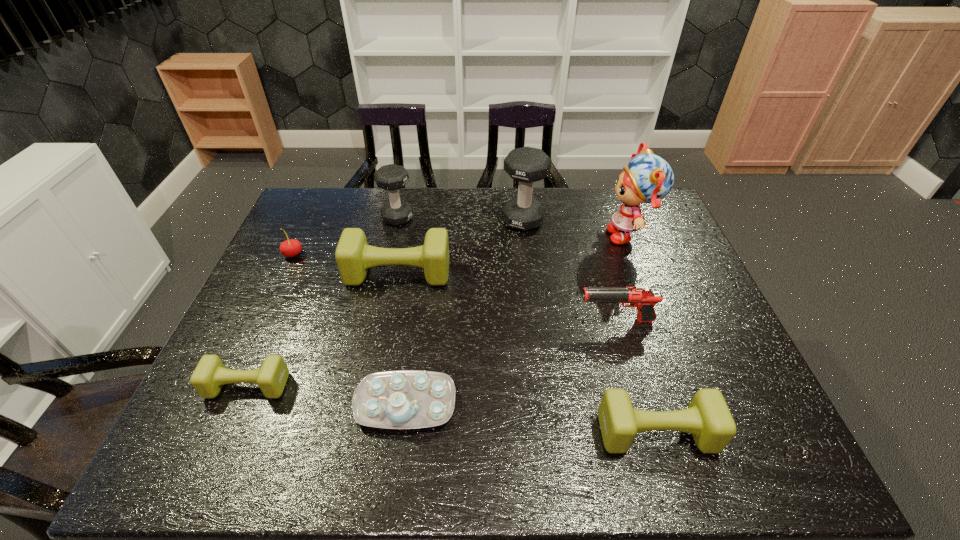
Identify the location of the second biggest olive dumbbell. This screenshot has height=540, width=960. (707, 417).

Where is `the nearest dumbbell`? This screenshot has width=960, height=540. the nearest dumbbell is located at coordinates (707, 417).

Find the location of `chinaware`. chinaware is located at coordinates (404, 399).

Locate an element on the screen. This screenshot has width=960, height=540. the second nearest dumbbell is located at coordinates (209, 376).

Where is `the leftmost olive dumbbell`? The image size is (960, 540). the leftmost olive dumbbell is located at coordinates (209, 376).

At what (x,y) coordinates should I click in order to perform the action: click on vacant space positioned 0.390m on the face of the doll. Please return your answer as a coordinate pair (x, y). Looking at the image, I should click on (484, 235).

Locate an element on the screen. This screenshot has height=540, width=960. blank space located on the face of the doll is located at coordinates (527, 235).

I want to click on free spot located 0.060m on the face of the doll, so click(x=587, y=235).

What are the coordinates of `vacant area located on the right of the second dumbbell from right to left` in the screenshot? It's located at (595, 220).

Find the location of a particular element. This screenshot has width=960, height=540. free space located 0.350m on the front of the seventh shortest object is located at coordinates (378, 306).